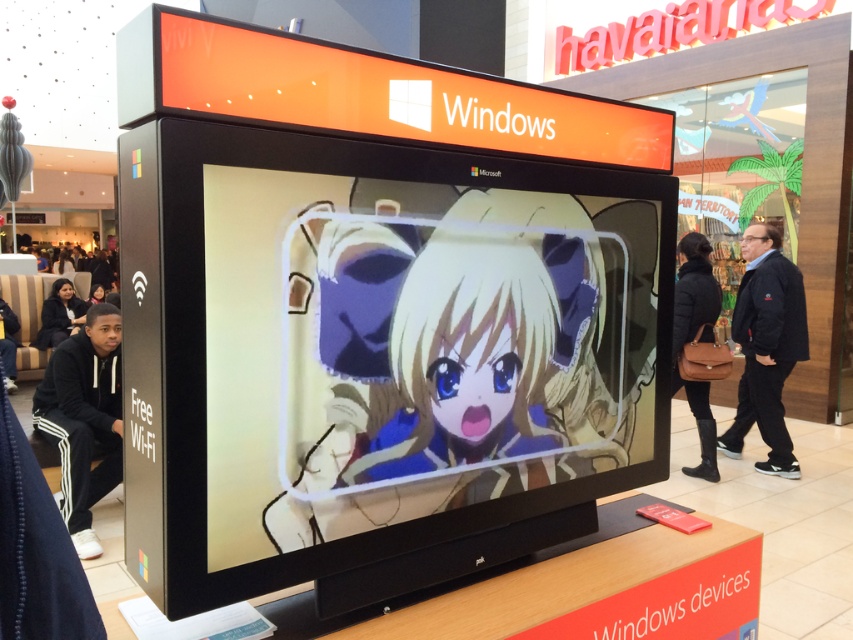
Question: Which object is positioned closest to the matte black monitor at center?

Choices:
 (A) black fleece pants at lower left
 (B) black hoodie at lower left

Answer: (A)

Question: Is black fabric jacket at right bigger than black hoodie at lower left?

Choices:
 (A) no
 (B) yes

Answer: (B)

Question: Does matte black monitor at center have a larger size compared to black leather bag at right?

Choices:
 (A) yes
 (B) no

Answer: (A)

Question: Can you confirm if black leather bag at right is positioned below black hoodie at lower left?

Choices:
 (A) yes
 (B) no

Answer: (B)

Question: Which point is farther to the camera?

Choices:
 (A) black leather bag at right
 (B) black leather jacket at lower left
 (C) black fabric jacket at right

Answer: (B)

Question: Estimate the real-world distances between objects in this image. Which object is farther from the black fabric jacket at right?

Choices:
 (A) black leather jacket at lower left
 (B) matte black monitor at center

Answer: (A)